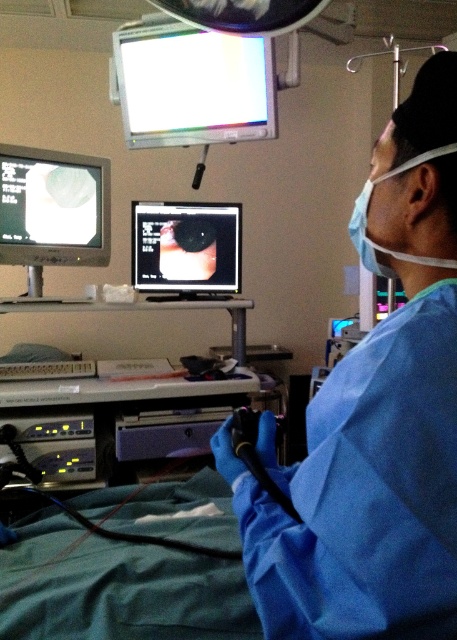
Question: Does white glossy monitor at upper center have a lesser width compared to matte black monitor at center?

Choices:
 (A) yes
 (B) no

Answer: (B)

Question: Can you confirm if matte black monitor at upper left is thinner than matte black monitor at center?

Choices:
 (A) no
 (B) yes

Answer: (B)

Question: Does blue surgical gown at center appear over white glossy monitor at upper center?

Choices:
 (A) yes
 (B) no

Answer: (B)

Question: Which object is positioned closest to the matte black monitor at upper left?

Choices:
 (A) white glossy monitor at upper center
 (B) matte black monitor at center
 (C) blue surgical gown at center

Answer: (B)

Question: Which point is farther to the camera?

Choices:
 (A) (53, 212)
 (B) (174, 234)

Answer: (B)

Question: Which point is closer to the camera taking this photo?

Choices:
 (A) (211, 42)
 (B) (176, 253)
 (C) (445, 252)

Answer: (C)